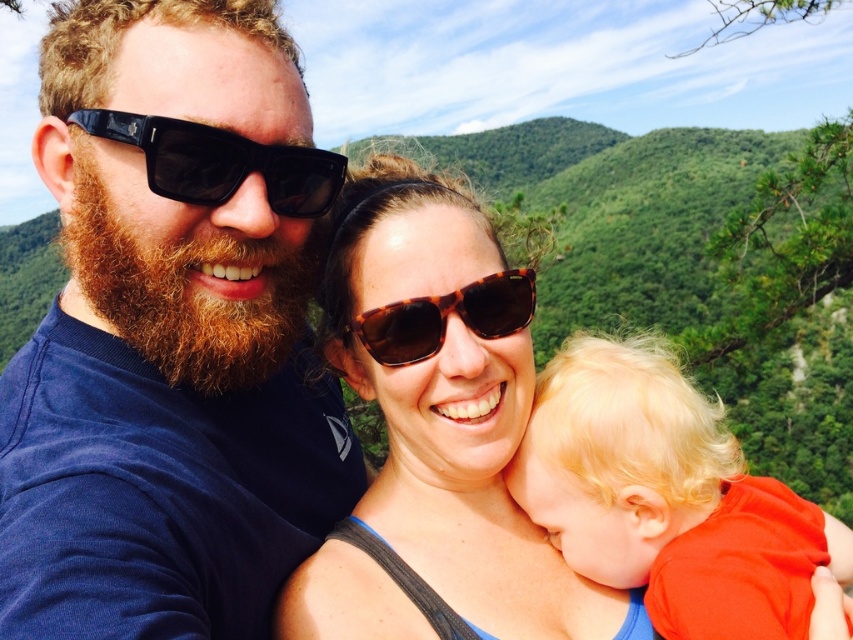
You are a photographer adjusting the focus on your camera. You want to ensure both the matte black sunglasses at left and the tortoiseshell sunglasses at center are clearly visible in the photo. Which sunglasses should you adjust the focus on first to ensure both are sharp?

You should focus on the matte black sunglasses at left first since they are wider than the tortoiseshell sunglasses at center, so ensuring their clarity will help the narrower ones also be in focus.

You are a photographer trying to capture a closeup of the two adults in the scene. You notice that the black plastic sunglasses at left and the tortoiseshell sunglasses at center have different heights. Which pair of sunglasses would require you to adjust your camera angle upwards more to focus on the lenses?

The tortoiseshell sunglasses at center has a greater height than the black plastic sunglasses at left, so you would need to adjust your camera angle upwards more to focus on the lenses of the tortoiseshell sunglasses at center.